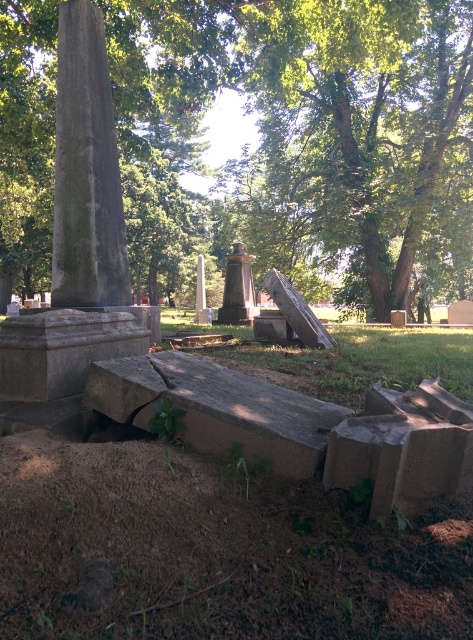
You are planning to place a new bench in the cemetery. The bench is 1.5 meters wide. You want to place it between the green rough bark tree at upper left and the polished bronze statue at center. Will the bench fit in the space between them?

The green rough bark tree at upper left is wider than the polished bronze statue at center. However, the question is about the space between them, not their widths. The provided description does not specify the distance between the two objects, so it is impossible to determine if the bench will fit based on the given information.

You are standing at the point marked by coordinates point (305, 136) in the cemetery scene. What object is located at this point?

The point (305, 136) corresponds to the green rough bark tree at upper left.

You are a gardener planning to plant a new tree in the cemetery. You notice the green rough bark tree at upper left and the smooth gray stone at center. Which object is taller and would cast a longer shadow during midday?

The green rough bark tree at upper left is much taller as smooth gray stone at center, so it would cast a longer shadow during midday.